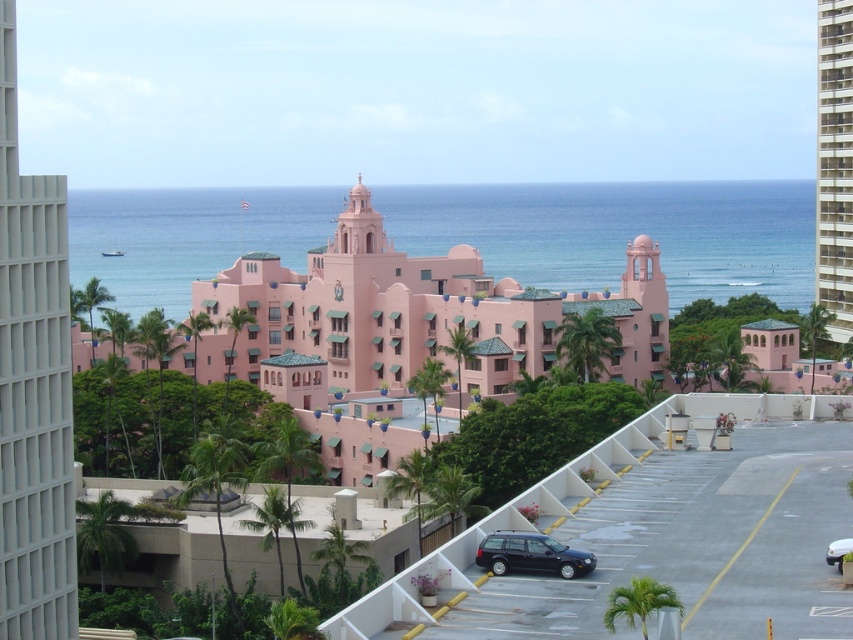
Question: Which object is positioned farthest from the dark blue matte station wagon at lower right?

Choices:
 (A) blue water at center
 (B) pink concrete building at right

Answer: (A)

Question: Estimate the real-world distances between objects in this image. Which object is closer to the pink concrete building at right?

Choices:
 (A) blue water at center
 (B) matte pink building at left
 (C) matte black car at center

Answer: (B)

Question: Can you confirm if dark blue matte station wagon at lower right is positioned to the left of matte black car at center?

Choices:
 (A) no
 (B) yes

Answer: (B)

Question: Estimate the real-world distances between objects in this image. Which object is closer to the pink matte building at center?

Choices:
 (A) dark blue matte station wagon at lower right
 (B) matte black car at center

Answer: (A)

Question: In this image, where is matte pink building at left located relative to dark blue matte station wagon at lower right?

Choices:
 (A) left
 (B) right

Answer: (A)

Question: Considering the relative positions of pink matte building at center and dark blue matte station wagon at lower right in the image provided, where is pink matte building at center located with respect to dark blue matte station wagon at lower right?

Choices:
 (A) right
 (B) left

Answer: (B)